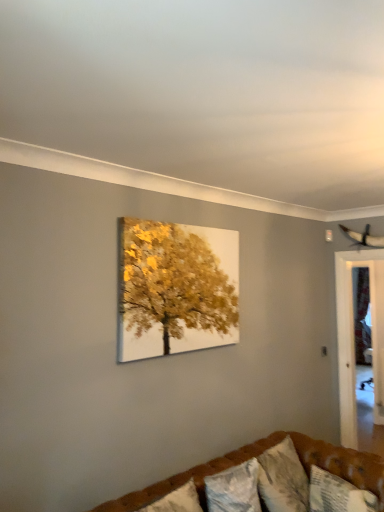
Question: From the image's perspective, is transparent glass door at right above textured white pillow at lower right, which appears as the first pillow when viewed from the right?

Choices:
 (A) no
 (B) yes

Answer: (B)

Question: Does transparent glass door at right have a larger size compared to textured white pillow at lower right, the 2th pillow viewed from the left?

Choices:
 (A) yes
 (B) no

Answer: (A)

Question: Is transparent glass door at right oriented towards textured white pillow at lower right, which appears as the first pillow when viewed from the right?

Choices:
 (A) no
 (B) yes

Answer: (A)

Question: Can you confirm if transparent glass door at right is taller than textured white pillow at lower right, which appears as the first pillow when viewed from the right?

Choices:
 (A) no
 (B) yes

Answer: (B)

Question: Is transparent glass door at right behind textured white pillow at lower right, which appears as the first pillow when viewed from the right?

Choices:
 (A) yes
 (B) no

Answer: (A)

Question: From the image's perspective, does transparent glass door at right appear lower than textured white pillow at lower right, the 2th pillow viewed from the left?

Choices:
 (A) no
 (B) yes

Answer: (A)

Question: Is brown tufted couch at lower center smaller than textured white pillow at lower right, which appears as the first pillow when viewed from the right?

Choices:
 (A) no
 (B) yes

Answer: (A)

Question: Does brown tufted couch at lower center have a greater width compared to textured white pillow at lower right, the 2th pillow viewed from the left?

Choices:
 (A) no
 (B) yes

Answer: (B)

Question: Is brown tufted couch at lower center turned away from textured white pillow at lower right, which appears as the first pillow when viewed from the right?

Choices:
 (A) no
 (B) yes

Answer: (A)

Question: Considering the relative sizes of brown tufted couch at lower center and textured white pillow at lower right, which appears as the first pillow when viewed from the right, in the image provided, is brown tufted couch at lower center shorter than textured white pillow at lower right, which appears as the first pillow when viewed from the right,?

Choices:
 (A) no
 (B) yes

Answer: (A)

Question: Could you tell me if brown tufted couch at lower center is turned towards textured white pillow at lower right, the 2th pillow viewed from the left?

Choices:
 (A) no
 (B) yes

Answer: (B)

Question: From the image's perspective, is brown tufted couch at lower center under textured white pillow at lower right, which appears as the first pillow when viewed from the right?

Choices:
 (A) no
 (B) yes

Answer: (B)

Question: Can you confirm if transparent glass door at right is taller than textured white pillow at lower center, arranged as the 2th pillow when viewed from the right?

Choices:
 (A) no
 (B) yes

Answer: (B)